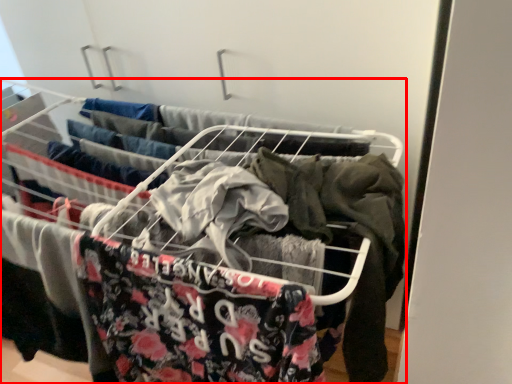
Question: Where is furniture (annotated by the red box) located in relation to clothing in the image?

Choices:
 (A) left
 (B) right

Answer: (B)